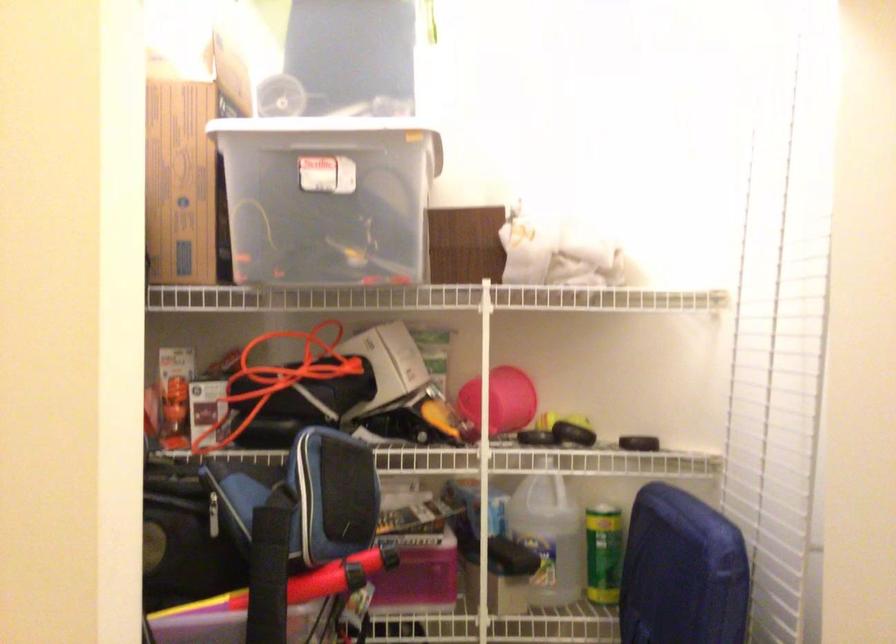
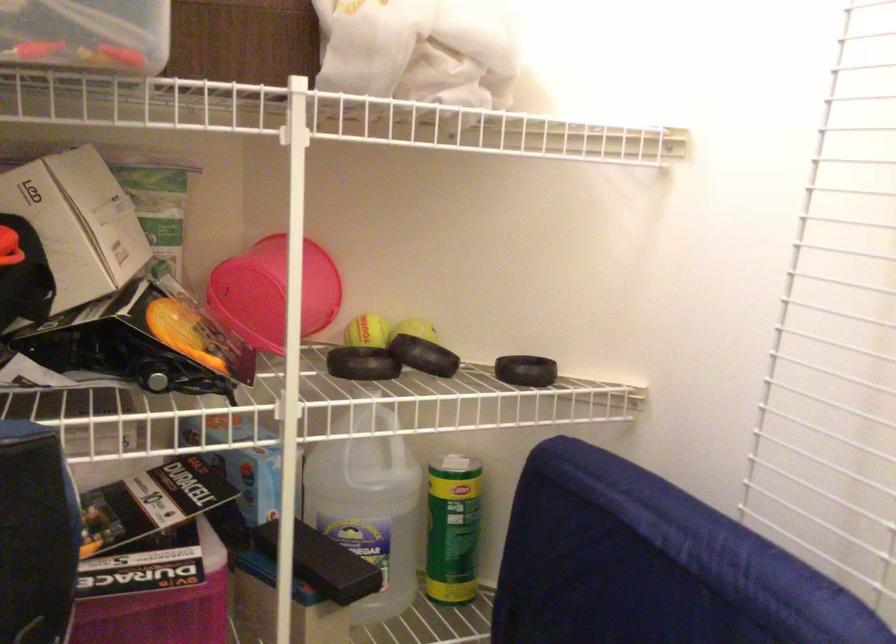
Question: The camera is either moving clockwise (left) or counter-clockwise (right) around the object. The first image is from the beginning of the video and the second image is from the end. Is the camera moving left or right when shooting the video?

Choices:
 (A) Left
 (B) Right

Answer: (A)